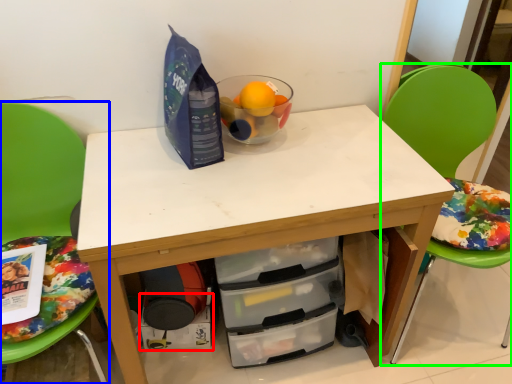
Question: Considering the real-world distances, which object is farthest from drawer (highlighted by a red box)? chair (highlighted by a blue box) or chair (highlighted by a green box)?

Choices:
 (A) chair
 (B) chair

Answer: (B)